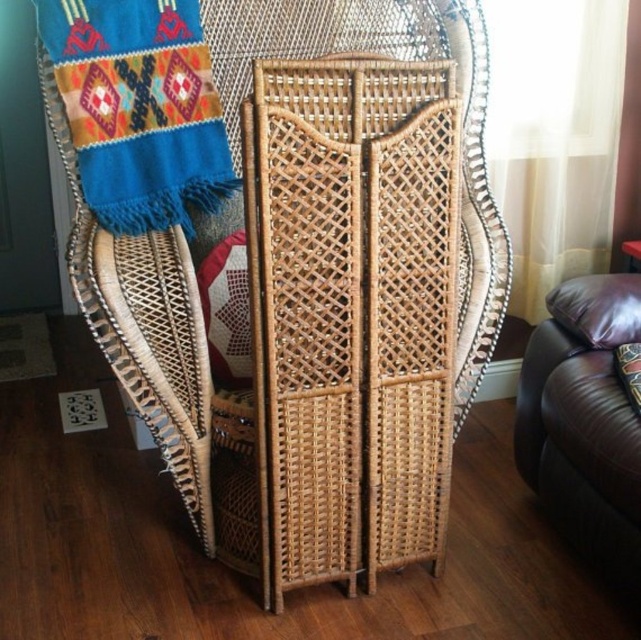
Question: Which of these objects is positioned farthest from the translucent fabric curtain at upper right?

Choices:
 (A) woven woolen scarf at upper left
 (B) natural woven wood armchair at center
 (C) leather cushion at lower right
 (D) leather cushion at right

Answer: (A)

Question: Observing the image, what is the correct spatial positioning of brown leather couch at lower right in reference to leather cushion at lower right?

Choices:
 (A) below
 (B) above

Answer: (A)

Question: Which of the following is the farthest from the observer?

Choices:
 (A) tap(101, 147)
 (B) tap(229, 186)
 (C) tap(617, 356)
 (D) tap(617, 580)

Answer: (C)

Question: Based on their relative distances, which object is farther from the leather cushion at lower right?

Choices:
 (A) translucent fabric curtain at upper right
 (B) woven woolen scarf at upper left

Answer: (B)

Question: Is woven woolen scarf at upper left bigger than brown leather couch at lower right?

Choices:
 (A) yes
 (B) no

Answer: (B)

Question: Can you confirm if woven woolen scarf at upper left is thinner than leather cushion at right?

Choices:
 (A) yes
 (B) no

Answer: (B)